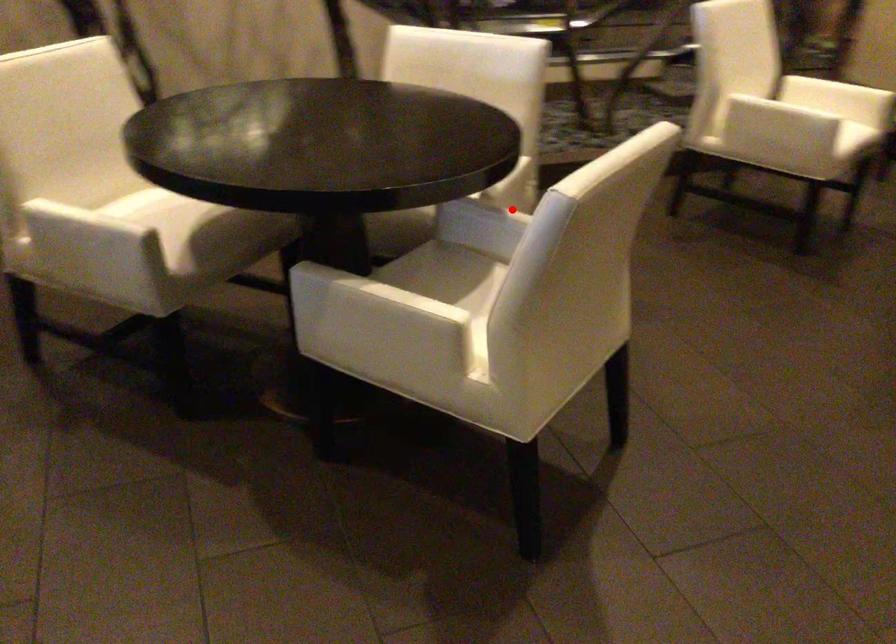
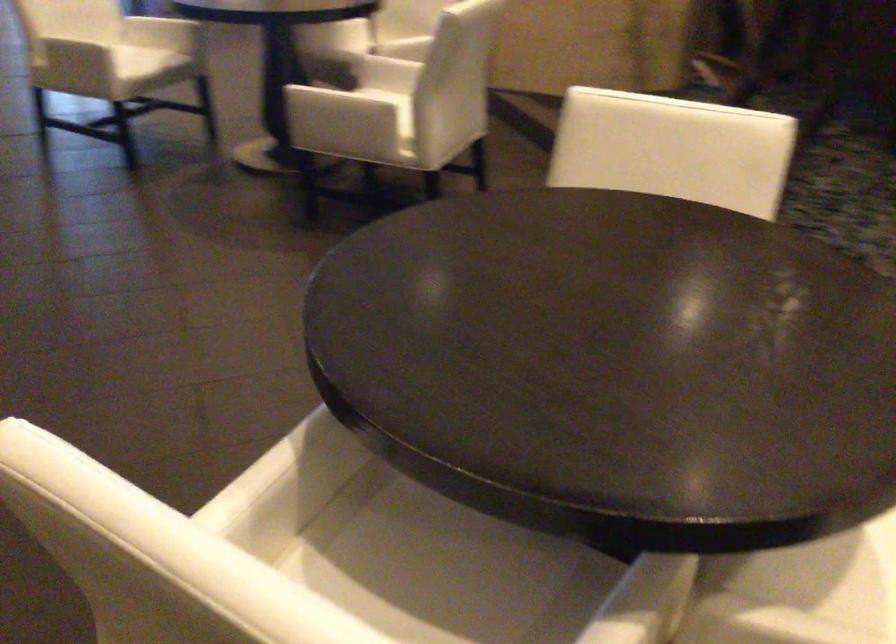
Question: I am providing you with two images of the same scene from different viewpoints. Given a red point in image1, look at the same physical point in image2. Is it:

Choices:
 (A) Closer to the viewpoint
 (B) Farther from the viewpoint

Answer: (A)